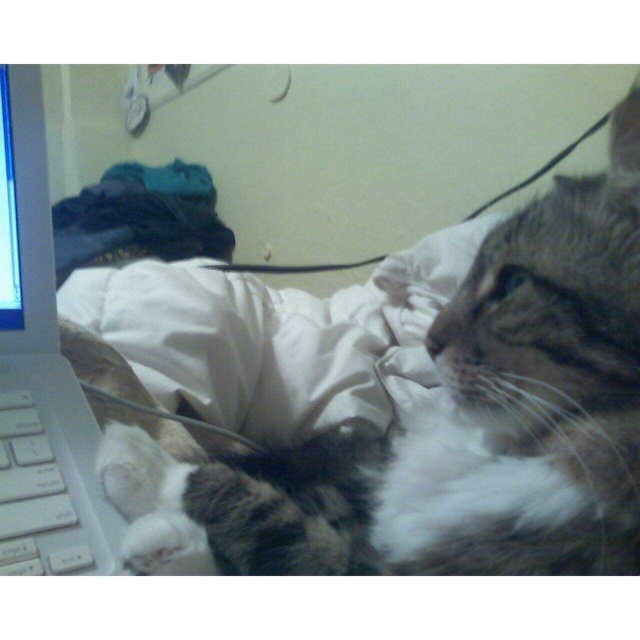
Question: Among these objects, which one is farthest from the camera?

Choices:
 (A) tabby fur cat at center
 (B) white plastic keyboard at lower left

Answer: (B)

Question: Which of the following is the farthest from the observer?

Choices:
 (A) (12, 496)
 (B) (48, 483)

Answer: (B)

Question: Among these points, which one is nearest to the camera?

Choices:
 (A) (77, 500)
 (B) (419, 444)

Answer: (A)

Question: Is the position of white plastic keyboard at left less distant than that of white plastic keyboard at lower left?

Choices:
 (A) no
 (B) yes

Answer: (A)

Question: Is white plastic keyboard at left bigger than white plastic keyboard at lower left?

Choices:
 (A) yes
 (B) no

Answer: (A)

Question: Where is tabby fur cat at center located in relation to white plastic keyboard at left in the image?

Choices:
 (A) above
 (B) below

Answer: (B)